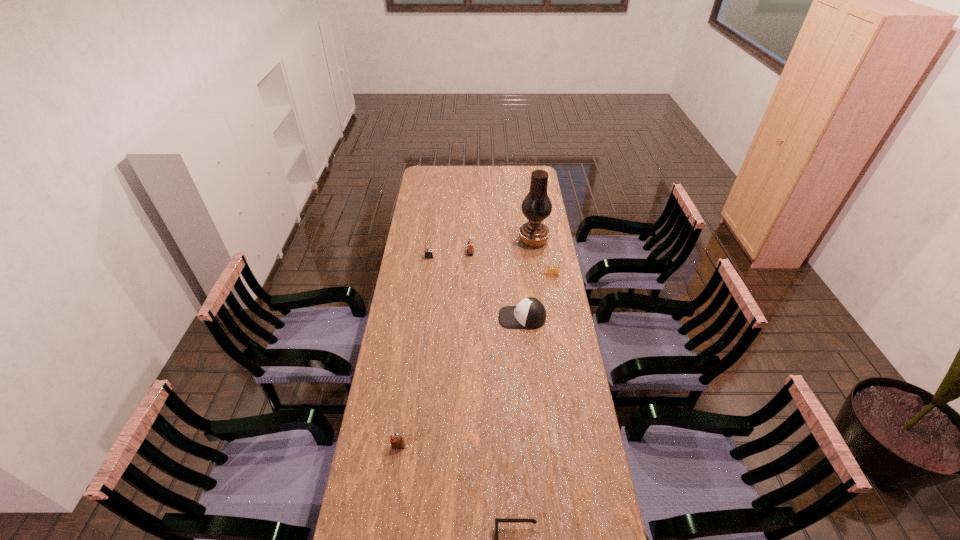
Image resolution: width=960 pixels, height=540 pixels. I want to click on vacant point located between the tallest object and the rightmost padlock, so click(x=543, y=258).

This screenshot has width=960, height=540. Identify the location of unoccupied position between the third nearest object and the second padlock from right to left. (496, 285).

Identify the location of vacant space that's between the cap and the oil lamp. Image resolution: width=960 pixels, height=540 pixels. (528, 279).

Where is `vacant region between the cap and the second padlock from right to left`? vacant region between the cap and the second padlock from right to left is located at coordinates (496, 285).

At what (x,y) coordinates should I click in order to perform the action: click on vacant space that is in between the fifth farthest object and the shortest padlock. Please return your answer as a coordinate pair (x, y). The width and height of the screenshot is (960, 540). Looking at the image, I should click on (461, 382).

Locate which object is the third closest to the third nearest object. Please provide its 2D coordinates. Your answer should be formatted as a tuple, i.e. [(x, y)], where the tuple contains the x and y coordinates of a point satisfying the conditions above.

[(536, 206)]

Locate an element on the screen. This screenshot has height=540, width=960. the third closest object relative to the second padlock from right to left is located at coordinates (529, 313).

Point out which padlock is positioned as the nearest to the third object from left to right. Please provide its 2D coordinates. Your answer should be formatted as a tuple, i.e. [(x, y)], where the tuple contains the x and y coordinates of a point satisfying the conditions above.

[(428, 253)]

Identify which padlock is located as the third nearest to the second nearest padlock. Please provide its 2D coordinates. Your answer should be formatted as a tuple, i.e. [(x, y)], where the tuple contains the x and y coordinates of a point satisfying the conditions above.

[(396, 442)]

Image resolution: width=960 pixels, height=540 pixels. I want to click on free space that satisfies the following two spatial constraints: 1. on the front-facing side of the fourth farthest object; 2. on the front panel of the fifth farthest object, so click(561, 318).